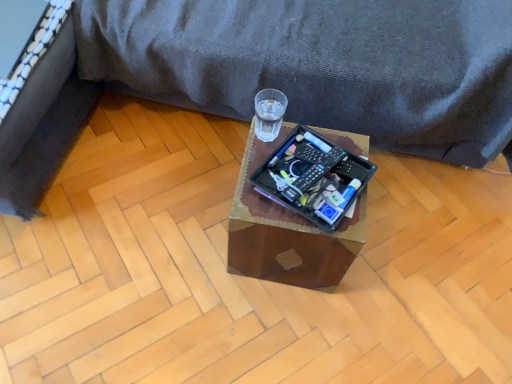
Question: Which is correct: black fabric bed frame at left is inside black plastic remote control at center, or outside of it?

Choices:
 (A) inside
 (B) outside

Answer: (B)

Question: Considering their positions, is black fabric bed frame at left located in front of or behind black plastic remote control at center?

Choices:
 (A) behind
 (B) front

Answer: (B)

Question: Which is nearer to the wooden tray at center?

Choices:
 (A) transparent glass at center
 (B) black fabric bed frame at left
 (C) transparent glass at center
 (D) black plastic remote control at center

Answer: (D)

Question: Estimate the real-world distances between objects in this image. Which object is closer to the black plastic remote control at center?

Choices:
 (A) black fabric bed frame at left
 (B) transparent glass at center
 (C) wooden tray at center
 (D) transparent glass at center

Answer: (C)